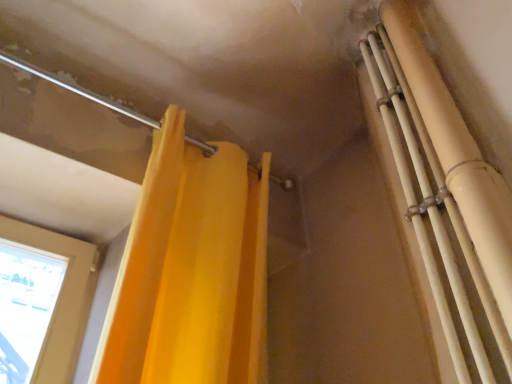
The image size is (512, 384). Find the location of `beige matte pipes at upper right`. beige matte pipes at upper right is located at coordinates (439, 227).

Describe the element at coordinates (439, 227) in the screenshot. The width and height of the screenshot is (512, 384). I see `beige matte pipes at upper right` at that location.

Identify the location of beige matte pipes at upper right. (439, 227).